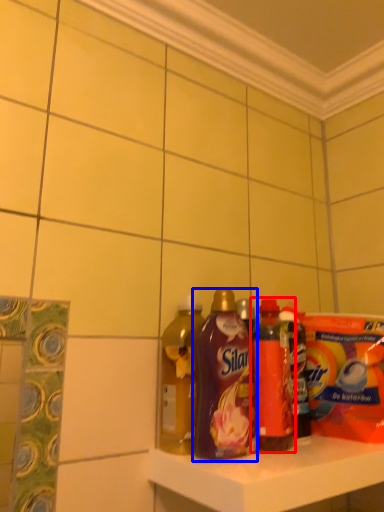
Question: Which point is closer to the camera, bottle (highlighted by a red box) or bottle (highlighted by a blue box)?

Choices:
 (A) bottle
 (B) bottle

Answer: (B)